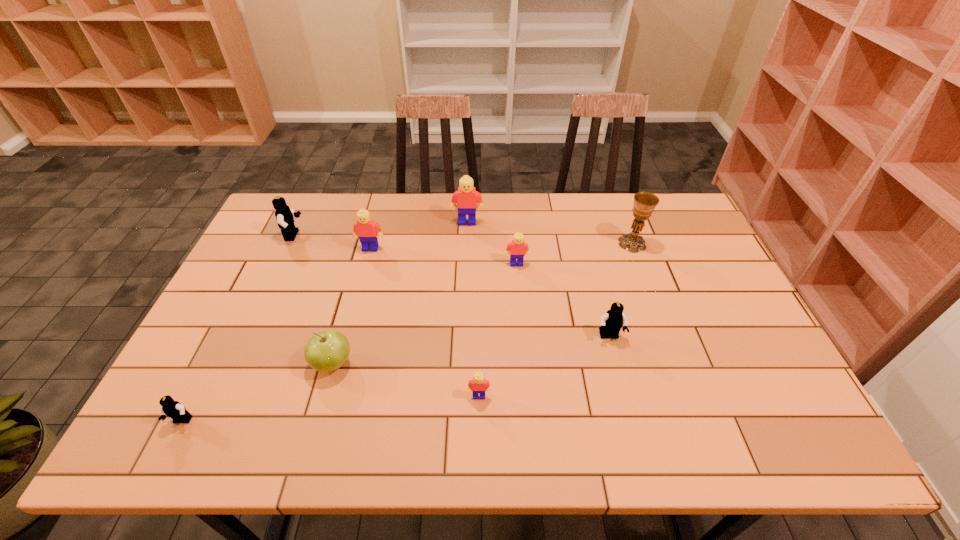
Locate an element on the screen. The height and width of the screenshot is (540, 960). vacant space that's between the third smallest yellow Lego and the nearest yellow Lego is located at coordinates (424, 322).

Locate an element on the screen. free space between the farthest black Lego and the sixth farthest Lego is located at coordinates (387, 316).

The image size is (960, 540). I want to click on vacant region between the sixth farthest Lego and the farthest object, so click(x=473, y=309).

You are a GUI agent. You are given a task and a screenshot of the screen. Output one action in this format:
    pyautogui.click(x=<x>, y=<y>)
    Task: Click on the object identified as the closest to the rightmost black Lego
    
    Given the screenshot: What is the action you would take?
    pyautogui.click(x=518, y=248)

I want to click on the third closest object relative to the fifth Lego from right to left, so click(327, 350).

The width and height of the screenshot is (960, 540). Find the location of `the closest Lego to the third smallest yellow Lego`. the closest Lego to the third smallest yellow Lego is located at coordinates (284, 215).

Where is `Lego that is the third closest to the third smallest yellow Lego`? The height and width of the screenshot is (540, 960). Lego that is the third closest to the third smallest yellow Lego is located at coordinates (518, 248).

Find the location of a particular element. This screenshot has width=960, height=540. yellow Lego object that ranks as the second closest to the gold chalice is located at coordinates (466, 197).

What are the coordinates of `the second closest yellow Lego to the apple` in the screenshot? It's located at (365, 228).

Locate an element on the screen. black Lego object that ranks as the third closest to the third nearest object is located at coordinates (611, 323).